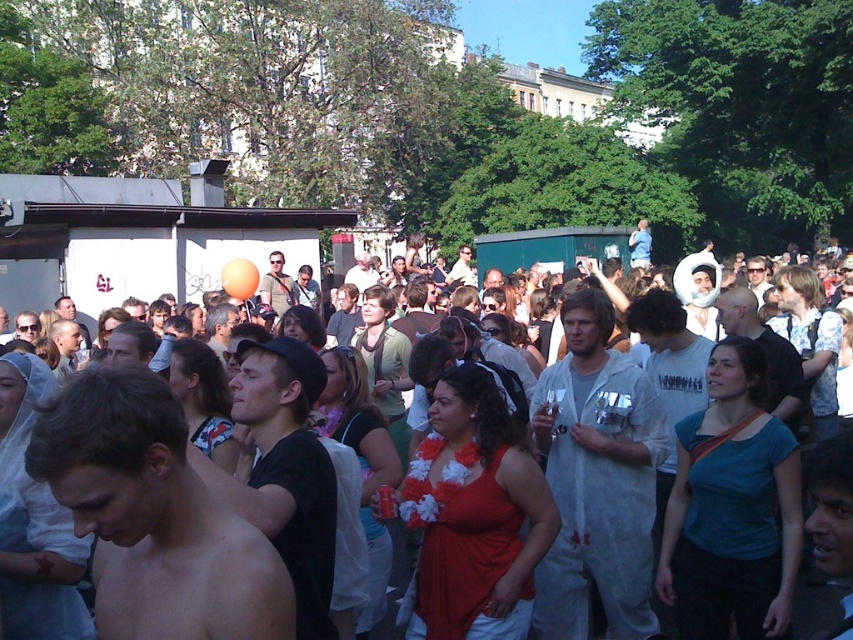
You are at a festival and want to find a friend wearing a black matte shirt at center. According to the coordinates provided, where should you look to find them?

The black matte shirt at center is located at point (283, 470), so you should look towards the center area slightly to the right and lower middle of the image.

You are a photographer at the event, and you want to take a photo that includes both the shiny skin at center and the white paper suit at center. Given that your camera has a maximum focus range of 10 meters, will you be able to capture both subjects in focus?

The distance between the shiny skin at center and the white paper suit at center is 10.85 meters, which exceeds the camera maximum focus range of 10 meters. Therefore, you cannot capture both subjects in focus.

You are at the event and want to locate the person wearing the black matte shirt at center among the white matte crowd at center. Which one is easier to spot due to its size?

The black matte shirt at center is smaller in size compared to the white matte crowd at center, so it might be harder to spot among the larger crowd members.